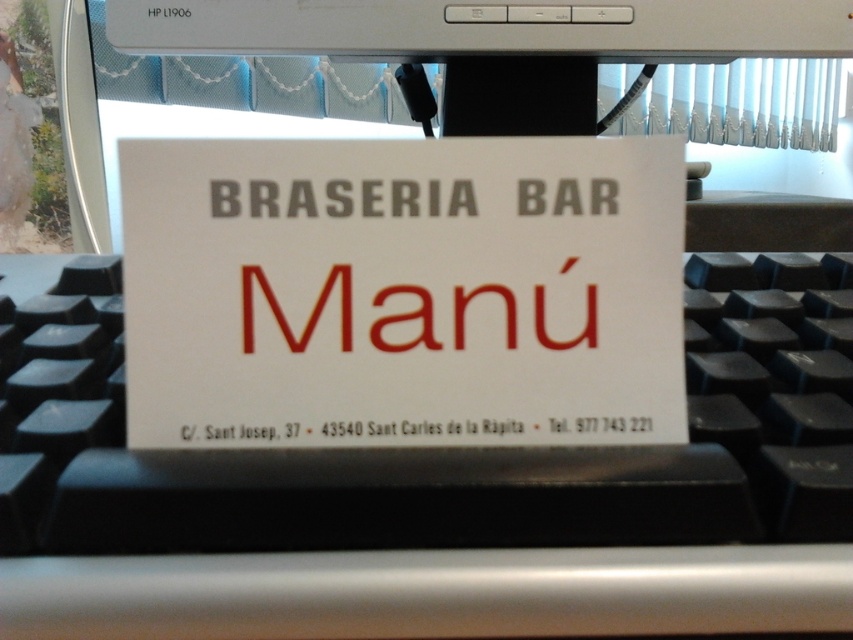
Question: Which of these objects is positioned closest to the black plastic keyboard at center?

Choices:
 (A) white plastic computer monitor at upper center
 (B) white paper sign at center

Answer: (B)

Question: Which object appears farthest from the camera in this image?

Choices:
 (A) black plastic keyboard at center
 (B) white plastic computer monitor at upper center

Answer: (B)

Question: Is white paper sign at center to the right of white plastic computer monitor at upper center from the viewer's perspective?

Choices:
 (A) no
 (B) yes

Answer: (B)

Question: From the image, what is the correct spatial relationship of black plastic keyboard at center in relation to white plastic computer monitor at upper center?

Choices:
 (A) above
 (B) below

Answer: (B)

Question: Is black plastic keyboard at center to the right of white plastic computer monitor at upper center from the viewer's perspective?

Choices:
 (A) no
 (B) yes

Answer: (B)

Question: Which is farther from the white paper sign at center?

Choices:
 (A) black plastic keyboard at center
 (B) white plastic computer monitor at upper center

Answer: (B)